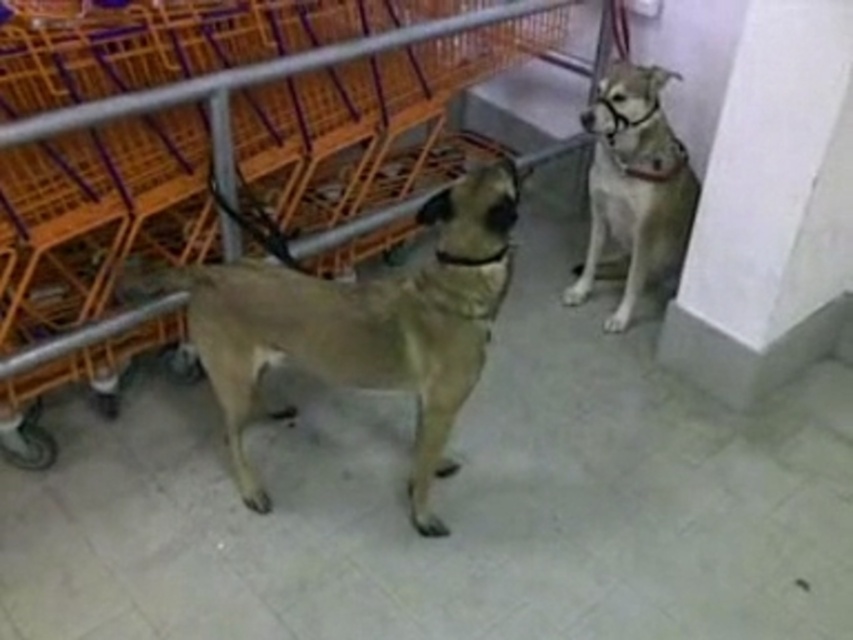
Can you confirm if orange plastic cart at left is positioned to the left of light brown fur at center?

Indeed, orange plastic cart at left is positioned on the left side of light brown fur at center.

Which is more to the right, orange plastic cart at left or light brown fur at center?

From the viewer's perspective, light brown fur at center appears more on the right side.

Is point (437, 168) positioned after point (306, 342)?

Yes, point (437, 168) is behind point (306, 342).

You are a GUI agent. You are given a task and a screenshot of the screen. Output one action in this format:
    pyautogui.click(x=<x>, y=<y>)
    Task: Click on the orange plastic cart at left
    
    Given the screenshot: What is the action you would take?
    pyautogui.click(x=215, y=161)

Which of these two, light brown fur at center or light brown fur at upper right, stands taller?

With more height is light brown fur at center.

Image resolution: width=853 pixels, height=640 pixels. Describe the element at coordinates (360, 324) in the screenshot. I see `light brown fur at center` at that location.

Where is `light brown fur at center`? light brown fur at center is located at coordinates (360, 324).

Does orange plastic cart at left have a greater width compared to light brown fur at upper right?

Yes.

Can you confirm if orange plastic cart at left is bigger than light brown fur at upper right?

Correct, orange plastic cart at left is larger in size than light brown fur at upper right.

Which is behind, point (28, 58) or point (602, 115)?

Point (602, 115)

The image size is (853, 640). What are the coordinates of `orange plastic cart at left` in the screenshot? It's located at (215, 161).